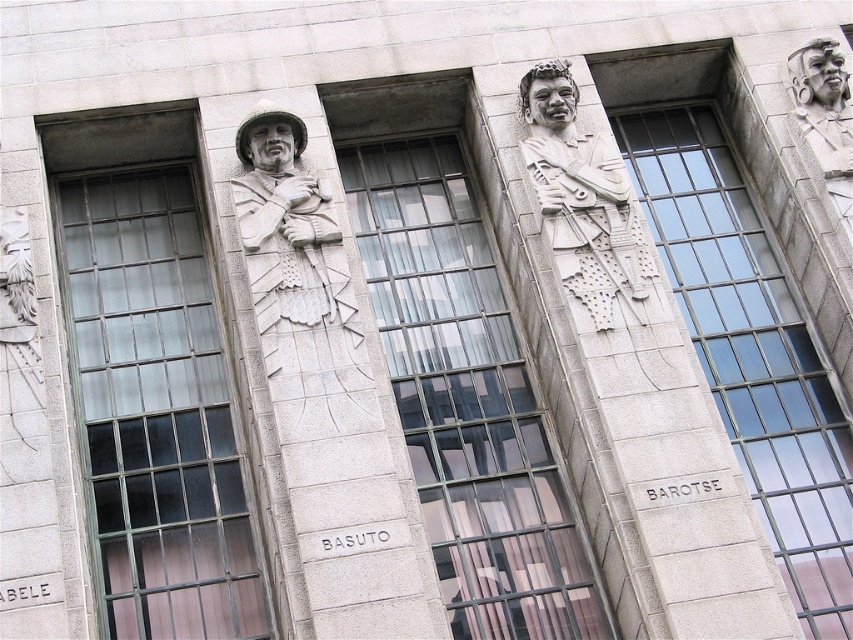
You are standing in front of the building and notice two points marked on the facade. The first point is at coordinates point (769, 326) and the second is at point (566, 161). Which point is closer to you?

Point (566, 161) is closer to you because it is in front of point (769, 326).